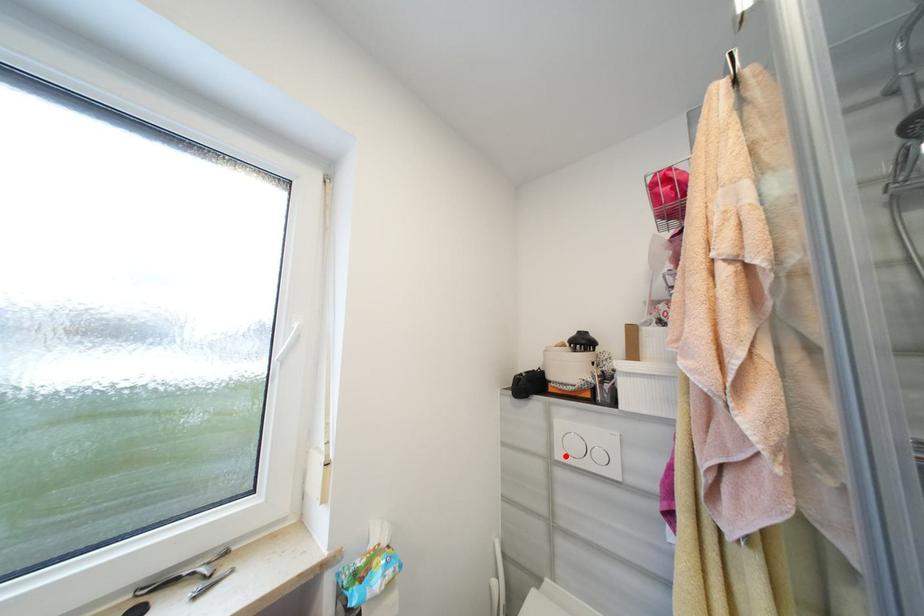
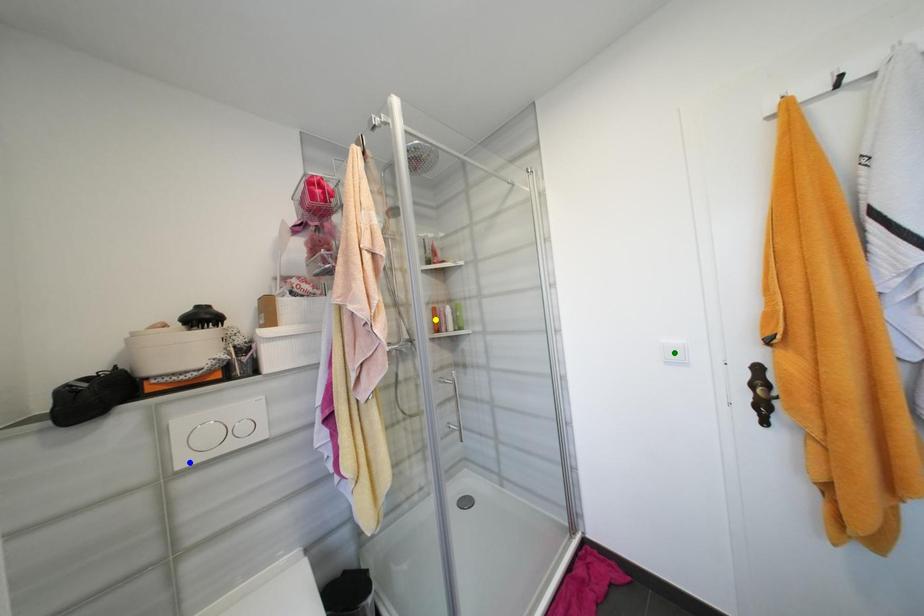
Question: I am providing you with two images of the same scene from different viewpoints. A red point is marked on the first image. You are given multiple points on the second image. Which spot in image 2 lines up with the point in image 1?

Choices:
 (A) blue point
 (B) yellow point
 (C) green point

Answer: (A)